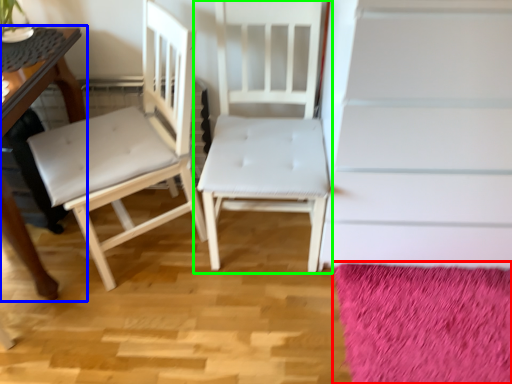
Question: Which object is the closest to the mat (highlighted by a red box)? Choose among these: table (highlighted by a blue box) or chair (highlighted by a green box).

Choices:
 (A) table
 (B) chair

Answer: (B)